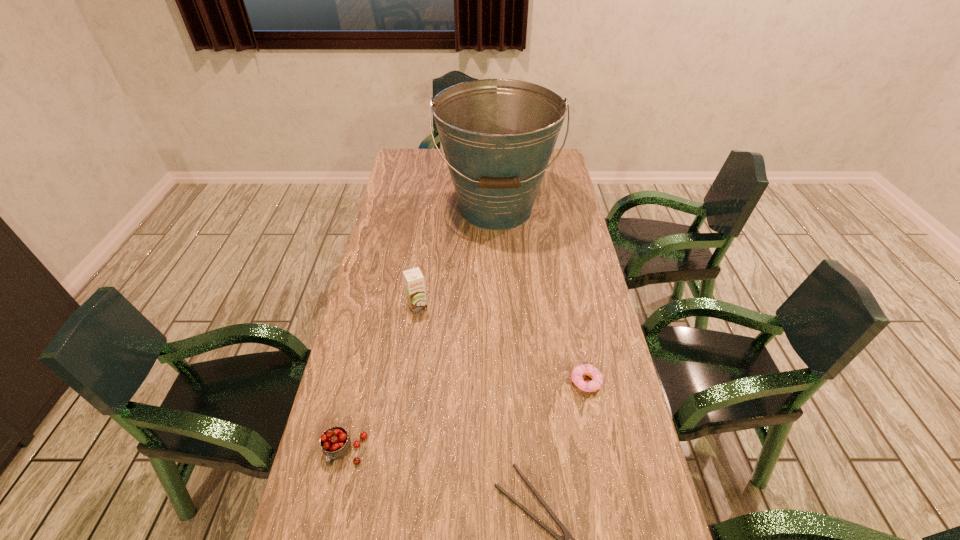
You are a GUI agent. You are given a task and a screenshot of the screen. Output one action in this format:
    pyautogui.click(x=<x>, y=<y>)
    Task: Click on the empty space between the tallest object and the chocolate milk
    The height and width of the screenshot is (540, 960).
    Given the screenshot: What is the action you would take?
    [457, 258]

Identify the location of free space between the third farthest object and the fourth nearest object. (502, 344).

You are a GUI agent. You are given a task and a screenshot of the screen. Output one action in this format:
    pyautogui.click(x=<x>, y=<y>)
    Task: Click on the free space that is in between the tallest object and the chocolate milk
    This screenshot has width=960, height=540.
    Given the screenshot: What is the action you would take?
    pyautogui.click(x=457, y=258)

Where is `unoccupied area between the farthest object and the fourth nearest object`? The image size is (960, 540). unoccupied area between the farthest object and the fourth nearest object is located at coordinates (457, 258).

At what (x,y) coordinates should I click in order to perform the action: click on vacant area that lies between the third shortest object and the second farthest object. Please return your answer as a coordinate pair (x, y). The width and height of the screenshot is (960, 540). Looking at the image, I should click on pos(381,380).

Where is `free area in between the third tallest object and the third farthest object`? free area in between the third tallest object and the third farthest object is located at coordinates (466, 417).

Locate an element on the screen. vacant space that's between the tallest object and the doughnut is located at coordinates (541, 295).

Identify the location of the second closest object to the third shortest object. pyautogui.click(x=414, y=281).

Locate an element on the screen. object that stands as the third closest to the leftmost object is located at coordinates (584, 369).

The height and width of the screenshot is (540, 960). Identify the location of free space that satisfies the following two spatial constraints: 1. with the handle on opposite sides of the tallest object; 2. on the right side of the doughnut. (504, 382).